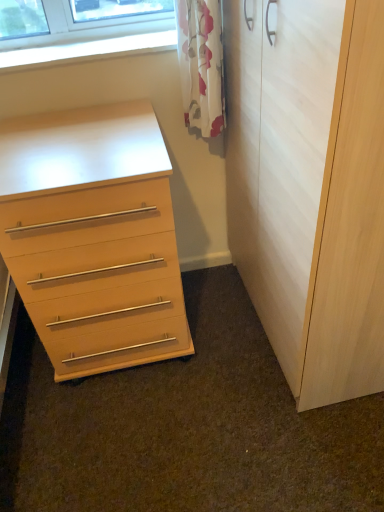
Question: From the image's perspective, is white floral curtain at upper center located above or below light wood/finish chest of drawers at left?

Choices:
 (A) below
 (B) above

Answer: (B)

Question: From a real-world perspective, is white floral curtain at upper center above or below light wood/finish chest of drawers at left?

Choices:
 (A) above
 (B) below

Answer: (A)

Question: Considering the real-world distances, which object is farthest from the white floral curtain at upper center?

Choices:
 (A) light wood/finish chest of drawers at left
 (B) light wood/texture cupboard at right
 (C) clear glass window at upper left

Answer: (A)

Question: Which object is the farthest from the light wood/texture cupboard at right?

Choices:
 (A) white floral curtain at upper center
 (B) clear glass window at upper left
 (C) light wood/finish chest of drawers at left

Answer: (B)